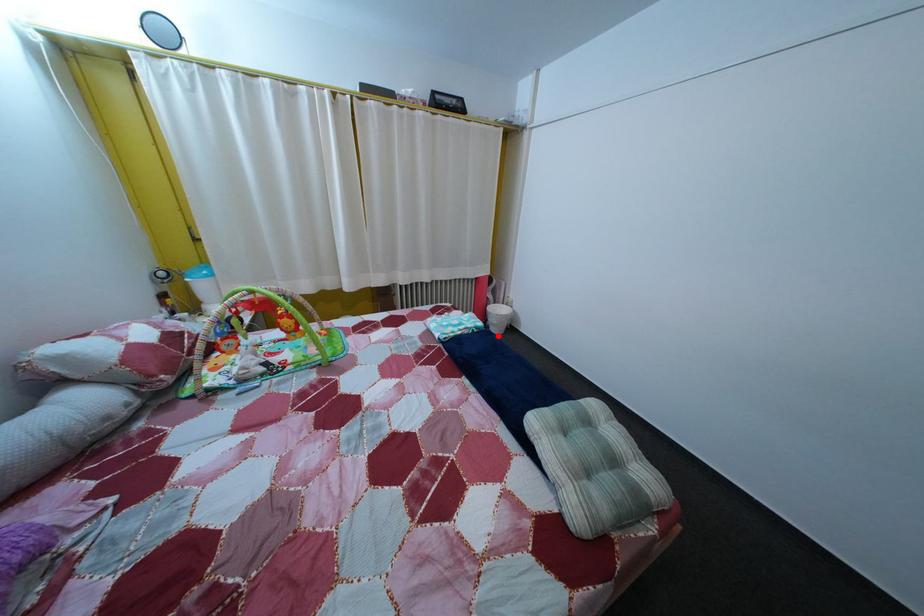
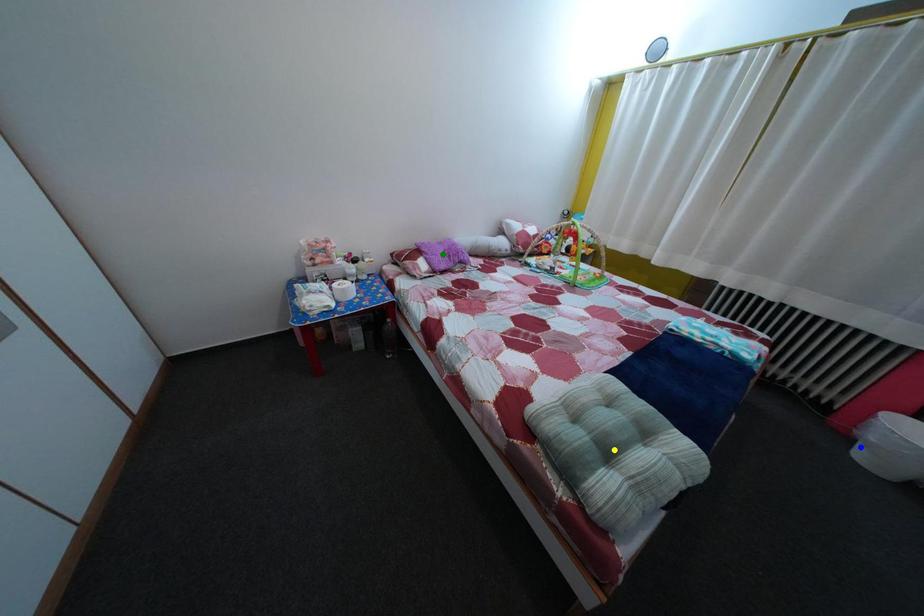
Question: I am providing you with two images of the same scene from different viewpoints. A red point is marked on the first image. You are given multiple points on the second image. In image 2, which mark is for the same physical point as the one in image 1?

Choices:
 (A) blue point
 (B) yellow point
 (C) green point

Answer: (A)